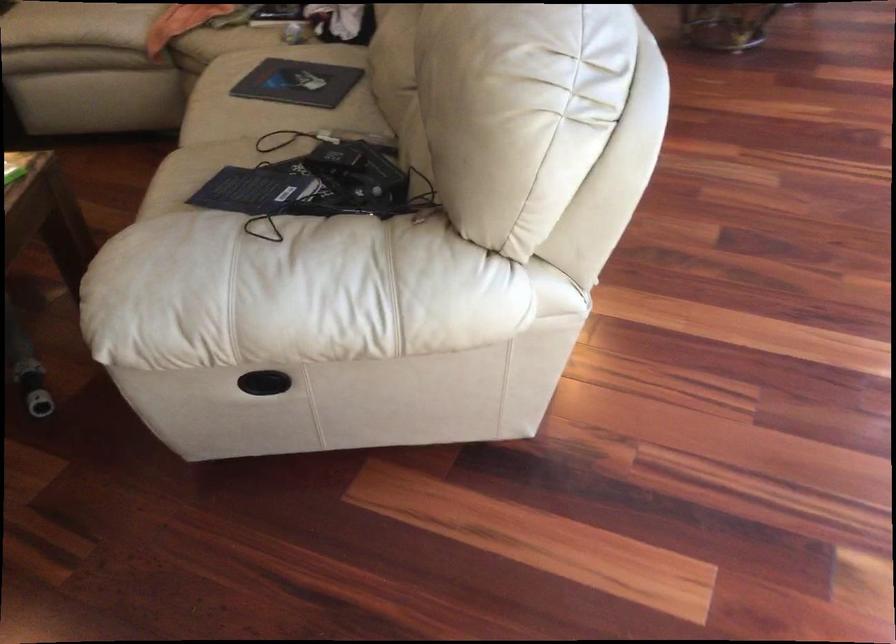
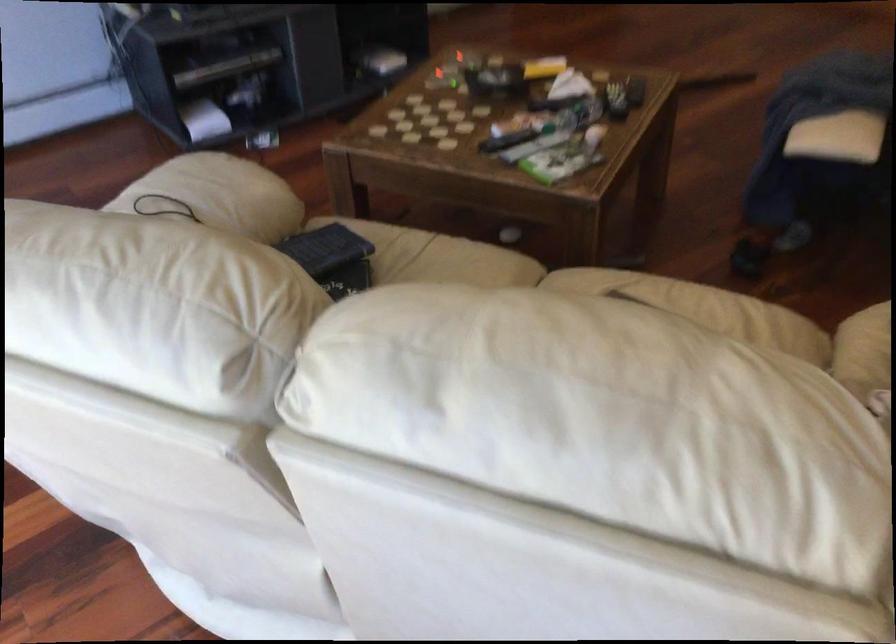
Locate, in the second image, the point that corresponds to (268,231) in the first image.

(162, 205)